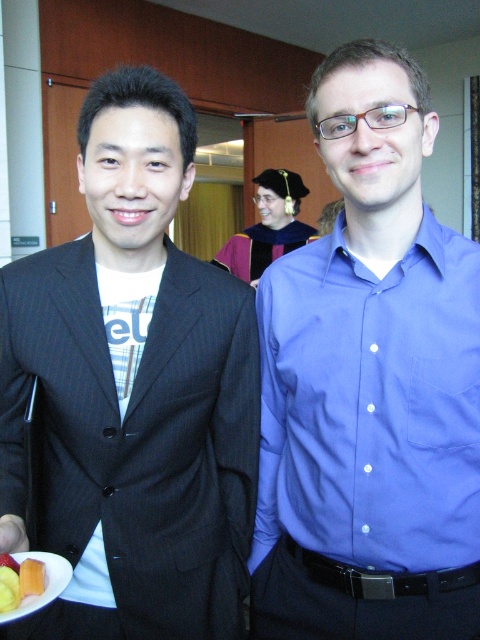
You are a photographer at the event and need to ensure both the blue smooth shirt at center and the yellow gelatinous at lower left are visible in the frame. Which object should you adjust your camera angle to prioritize capturing first, considering their sizes?

The blue smooth shirt at center is wider than the yellow gelatinous at lower left, so you should prioritize capturing the blue smooth shirt at center first since it occupies more space in the frame.

You are a photographer at this event and need to adjust the lighting so that both the blue smooth shirt at center and the dark pinstripe suit at left are well illuminated. Based on their positions, which one might require more light adjustment to ensure it stands out?

The blue smooth shirt at center is positioned under the dark pinstripe suit at left, so it might require more light adjustment to ensure it stands out as it is lower in position and could be in a shadowed area.